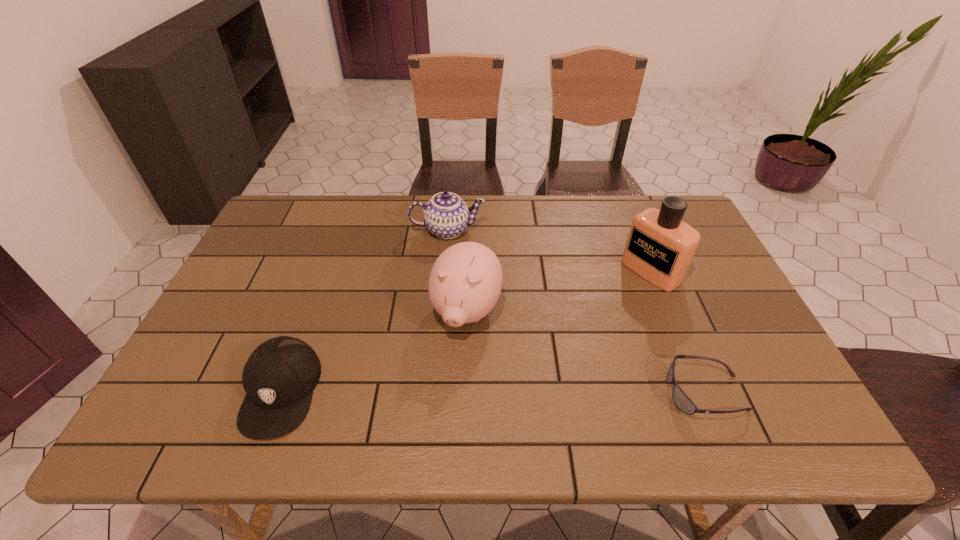
This screenshot has height=540, width=960. I want to click on free spot on the desktop that is between the cap and the shortest object and is positioned at the spout of the chinaware, so click(x=452, y=392).

The image size is (960, 540). I want to click on free space on the desktop that is between the cap and the sunglasses and is positioned at the snout of the second tallest object, so click(x=436, y=392).

This screenshot has width=960, height=540. I want to click on free space on the desktop that is between the leftmost object and the shortest object and is positioned on the front label of the tallest object, so click(x=477, y=392).